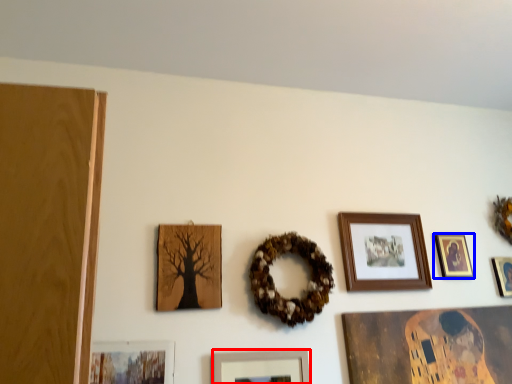
Question: Which point is closer to the camera, picture frame (highlighted by a red box) or picture frame (highlighted by a blue box)?

Choices:
 (A) picture frame
 (B) picture frame

Answer: (A)